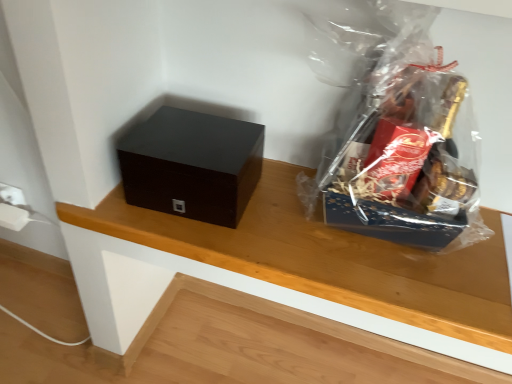
Measure the distance between wooden table at center and camera.

The depth of wooden table at center is 66.74 centimeters.

Find the location of a particular element. The image size is (512, 384). matte black box at left is located at coordinates (192, 165).

From a real-world perspective, is transparent plastic gift basket at upper right positioned above or below wooden table at center?

In terms of real-world spatial position, transparent plastic gift basket at upper right is above wooden table at center.

Who is taller, transparent plastic gift basket at upper right or wooden table at center?

Standing taller between the two is transparent plastic gift basket at upper right.

Between transparent plastic gift basket at upper right and wooden table at center, which one has larger width?

transparent plastic gift basket at upper right.

Based on the photo, considering their positions, is matte black box at left located in front of or behind wooden table at center?

matte black box at left is positioned closer to the viewer than wooden table at center.

Consider the image. Who is smaller, matte black box at left or wooden table at center?

wooden table at center is smaller.

Based on the photo, does matte black box at left have a greater height compared to wooden table at center?

Yes, matte black box at left is taller than wooden table at center.

This screenshot has height=384, width=512. I want to click on box on the right of wooden table at center, so click(192, 165).

Is transparent plastic gift basket at upper right far away from matte black box at left?

No, transparent plastic gift basket at upper right is not far away from matte black box at left.

Is matte black box at left completely or partially inside transparent plastic gift basket at upper right?

Actually, matte black box at left is outside transparent plastic gift basket at upper right.

From a real-world perspective, is transparent plastic gift basket at upper right beneath matte black box at left?

Actually, transparent plastic gift basket at upper right is physically above matte black box at left in the real world.

Considering the positions of points (372, 149) and (148, 174), is point (372, 149) closer to camera compared to point (148, 174)?

No, it is not.

Based on their sizes in the image, would you say matte black box at left is bigger or smaller than transparent plastic gift basket at upper right?

Considering their sizes, matte black box at left takes up less space than transparent plastic gift basket at upper right.

How different are the orientations of matte black box at left and transparent plastic gift basket at upper right in degrees?

They differ by 0.51 degrees in their facing directions.

Is matte black box at left inside or outside of transparent plastic gift basket at upper right?

matte black box at left is located beyond the bounds of transparent plastic gift basket at upper right.

Looking at this image, could you tell me if wooden table at center is turned towards transparent plastic gift basket at upper right?

No, wooden table at center is not turned towards transparent plastic gift basket at upper right.

From a real-world perspective, is wooden table at center physically above transparent plastic gift basket at upper right?

No, from a real-world perspective, wooden table at center is not over transparent plastic gift basket at upper right

Which is in front, point (469, 275) or point (446, 214)?

Point (446, 214)

From the image's perspective, is wooden table at center above transparent plastic gift basket at upper right?

No.

Is wooden table at center oriented towards matte black box at left?

No, wooden table at center is not oriented towards matte black box at left.

Who is taller, wooden table at center or matte black box at left?

With more height is matte black box at left.

Based on the photo, from the image's perspective, between wooden table at center and matte black box at left, which one is located above?

matte black box at left appears higher in the image.

This screenshot has height=384, width=512. In the image, there is a wooden table at center. Identify the location of plastic bag above it (from the image's perspective). (396, 132).

Where is `table behind the matte black box at left`? table behind the matte black box at left is located at coordinates pos(291,271).

Based on their spatial positions, is wooden table at center or transparent plastic gift basket at upper right further from matte black box at left?

Among the two, transparent plastic gift basket at upper right is located further to matte black box at left.

Considering their positions, is transparent plastic gift basket at upper right positioned closer to wooden table at center than matte black box at left?

matte black box at left.

Considering their positions, is matte black box at left positioned further to wooden table at center than transparent plastic gift basket at upper right?

transparent plastic gift basket at upper right is positioned further to the anchor wooden table at center.

Consider the image. Looking at the image, which one is located further to transparent plastic gift basket at upper right, wooden table at center or matte black box at left?

Based on the image, matte black box at left appears to be further to transparent plastic gift basket at upper right.

When comparing their distances from transparent plastic gift basket at upper right, does matte black box at left or wooden table at center seem closer?

Among the two, wooden table at center is located nearer to transparent plastic gift basket at upper right.

Which object lies nearer to the anchor point matte black box at left, transparent plastic gift basket at upper right or wooden table at center?

wooden table at center is positioned closer to the anchor matte black box at left.

This screenshot has width=512, height=384. What are the coordinates of `box positioned between transparent plastic gift basket at upper right and wooden table at center from near to far` in the screenshot? It's located at (192, 165).